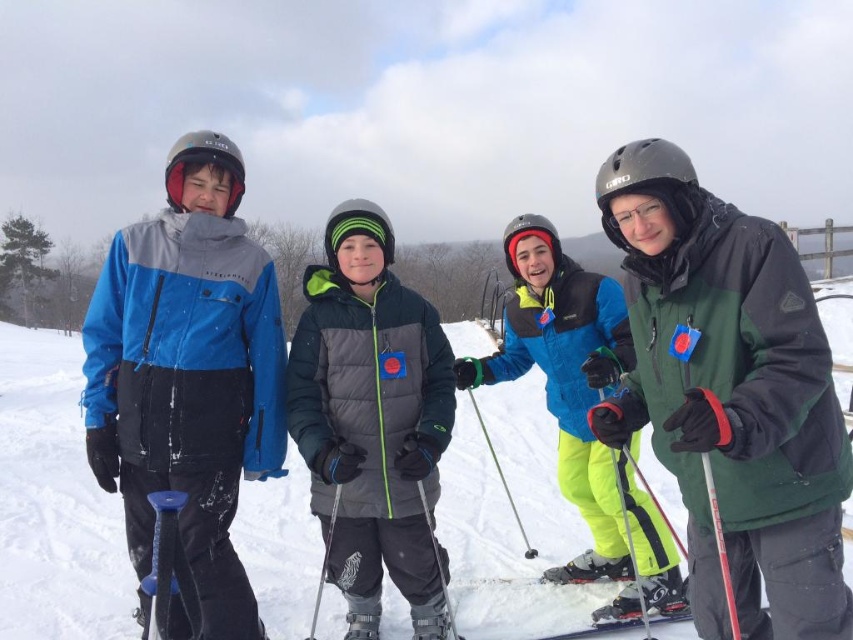
Question: Considering the real-world distances, which object is closest to the green matte jacket at center?

Choices:
 (A) neon yellow ski pants at center
 (B) gray matte jacket at center
 (C) blue matte ski jacket at left
 (D) matte blue ski jacket at left

Answer: (B)

Question: Estimate the real-world distances between objects in this image. Which object is farther from the green matte jacket at center?

Choices:
 (A) blue matte ski jacket at left
 (B) gray matte jacket at center
 (C) neon yellow ski pants at center
 (D) matte blue ski jacket at left

Answer: (A)

Question: Is gray matte jacket at center thinner than neon yellow ski pants at center?

Choices:
 (A) no
 (B) yes

Answer: (B)

Question: Can you confirm if gray matte jacket at center is bigger than neon yellow ski pants at center?

Choices:
 (A) no
 (B) yes

Answer: (A)

Question: Observing the image, what is the correct spatial positioning of matte blue ski jacket at left in reference to blue matte ski jacket at left?

Choices:
 (A) right
 (B) left

Answer: (A)

Question: Among these points, which one is nearest to the camera?

Choices:
 (A) (381, 500)
 (B) (418, 538)
 (C) (755, 305)

Answer: (C)